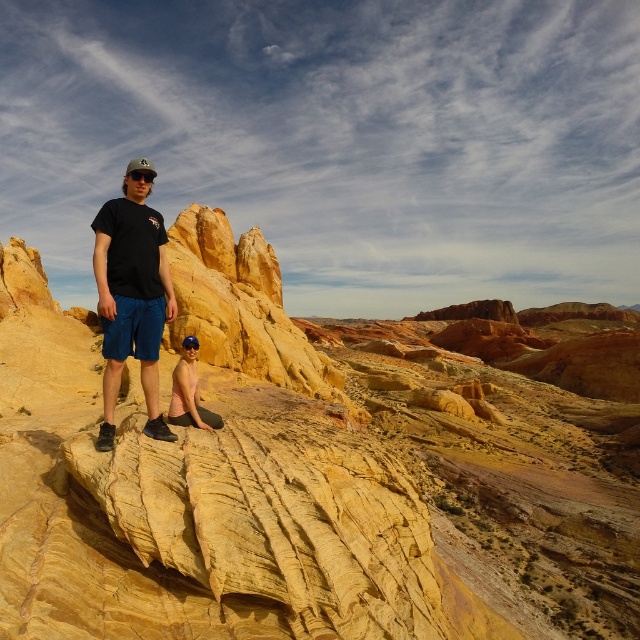
Question: Which point is farther to the camera?

Choices:
 (A) matte black t-shirt at center
 (B) yellow sandstone rock at center

Answer: (A)

Question: Is yellow sandstone rock at center thinner than pink matte skin at lower center?

Choices:
 (A) no
 (B) yes

Answer: (A)

Question: Is yellow sandstone rock at center closer to camera compared to matte black t-shirt at center?

Choices:
 (A) yes
 (B) no

Answer: (A)

Question: Which point is farther to the camera?

Choices:
 (A) (115, 301)
 (B) (179, 339)

Answer: (B)

Question: Does yellow sandstone rock at center appear over pink matte skin at lower center?

Choices:
 (A) yes
 (B) no

Answer: (A)

Question: Among these objects, which one is farthest from the camera?

Choices:
 (A) yellow sandstone rock at center
 (B) matte black t-shirt at center

Answer: (B)